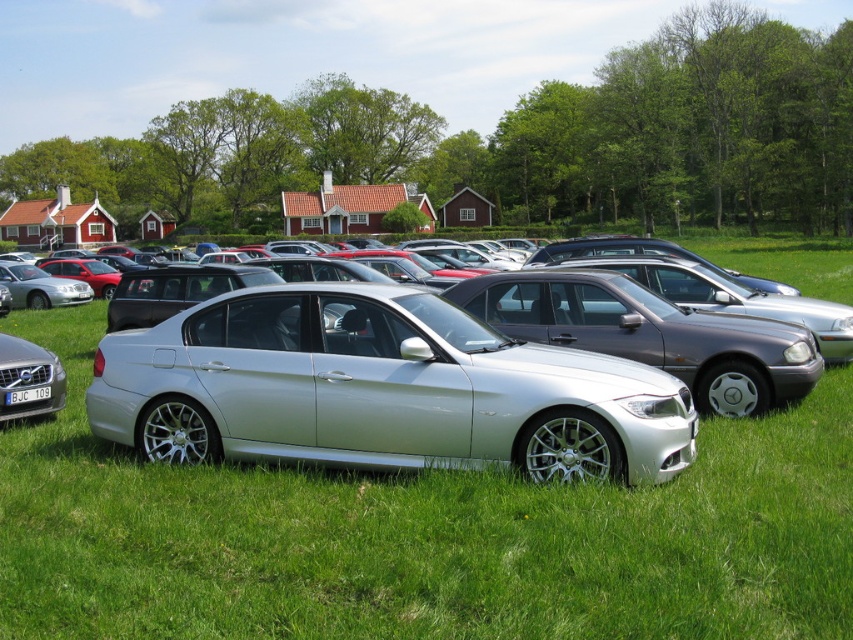
Question: Does silver metallic sedan at center come in front of silver metallic volvo at lower left?

Choices:
 (A) no
 (B) yes

Answer: (B)

Question: Which of the following is the farthest from the observer?

Choices:
 (A) silver metallic car at center
 (B) silver metallic sedan at center
 (C) silver metallic volvo at lower left

Answer: (C)

Question: Which point is farther to the camera?

Choices:
 (A) silver metallic car at center
 (B) silver metallic volvo at lower left
 (C) silver metallic sedan at center

Answer: (B)

Question: Is silver metallic car at center bigger than silver metallic sedan at center?

Choices:
 (A) no
 (B) yes

Answer: (B)

Question: Can you confirm if silver metallic car at center is thinner than silver metallic sedan at center?

Choices:
 (A) yes
 (B) no

Answer: (B)

Question: Among these objects, which one is nearest to the camera?

Choices:
 (A) silver metallic sedan at center
 (B) silver metallic car at center
 (C) silver metallic volvo at lower left

Answer: (B)